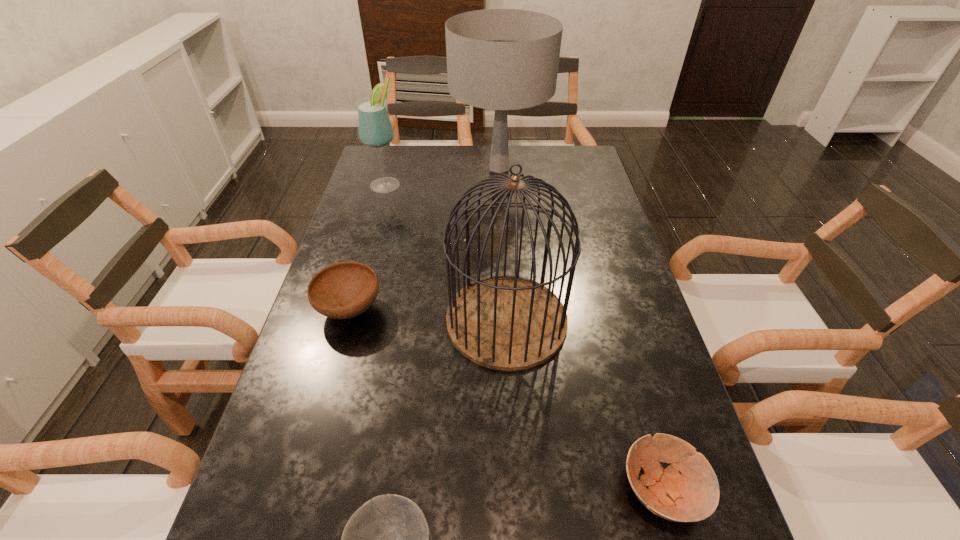
The image size is (960, 540). Identify the location of free space located on the front of the alcohol. (367, 255).

Locate an element on the screen. The image size is (960, 540). blank space located 0.400m on the right of the third shortest object is located at coordinates (545, 309).

In order to click on free space located on the left of the rightmost object in this screenshot , I will do pos(456,490).

Where is `lampshade that is positioned at the far edge`? lampshade that is positioned at the far edge is located at coordinates point(500,59).

Locate an element on the screen. This screenshot has height=540, width=960. alcohol that is at the far edge is located at coordinates (375, 129).

You are a GUI agent. You are given a task and a screenshot of the screen. Output one action in this format:
    pyautogui.click(x=<x>, y=<y>)
    Task: Click on the alcohol that is at the left edge
    
    Given the screenshot: What is the action you would take?
    pyautogui.click(x=375, y=129)

Identify the location of bowl that is at the left edge. The width and height of the screenshot is (960, 540). (343, 290).

Locate an element on the screen. The image size is (960, 540). object that is at the right edge is located at coordinates (692, 496).

You are a GUI agent. You are given a task and a screenshot of the screen. Output one action in this format:
    pyautogui.click(x=<x>, y=<y>)
    Task: Click on the object that is at the far left corner
    
    Given the screenshot: What is the action you would take?
    pyautogui.click(x=375, y=129)

In order to click on vacant area at the far edge in this screenshot , I will do [487, 153].